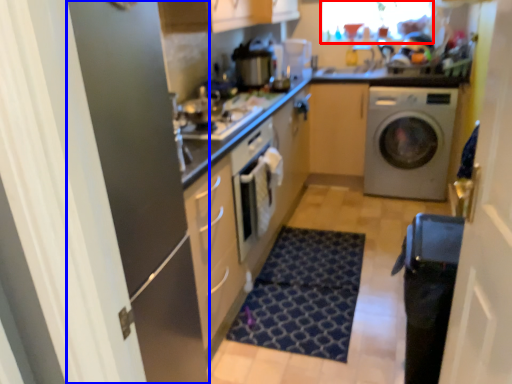
Question: Which object appears farthest to the camera in this image, window screen (highlighted by a red box) or screen door (highlighted by a blue box)?

Choices:
 (A) window screen
 (B) screen door

Answer: (A)